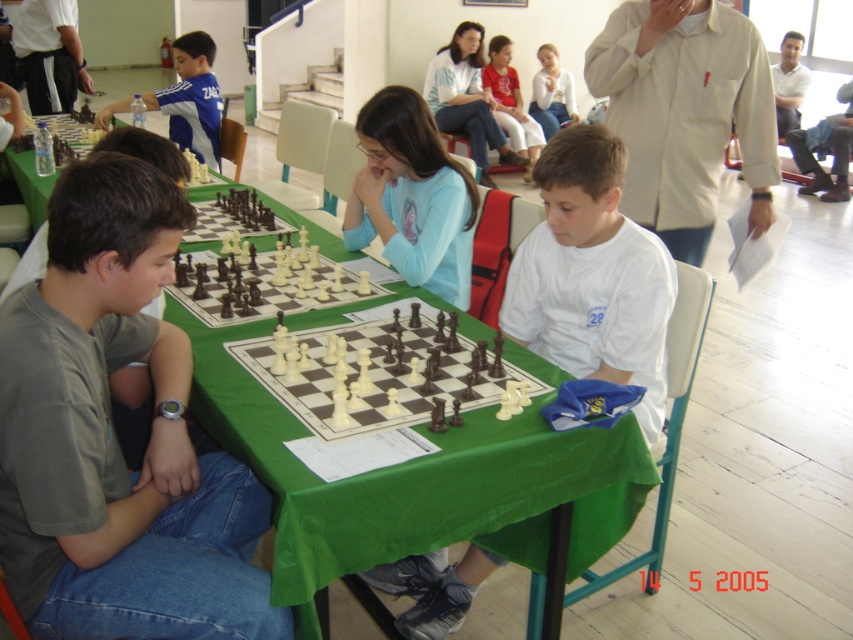
You are standing at the entrance of the chess tournament hall and want to quickly locate the green fabric table at center. Based on the coordinates provided, in which general direction should you look to find it?

The green fabric table at center is located at coordinates approximately 0.753 on the x axis and 0.489 on the y axis. Since the x coordinate is closer to 1, it is positioned more to the right side of the image. The y coordinate is near the middle, so it is centrally placed vertically. Therefore, you should look towards the right half of the image to find the green fabric table at center.

You are a chess player sitting at the table and need to place a new chess piece on the board. The board has two marked points, point 1 at coordinates point [195,240] and point 2 at coordinates point [786,38]. Which point is closer to you, the player?

Point [195,240] is in front of point [786,38], so the point closer to you is point [195,240].

You are a chess player sitting at the table with the matte pink shirt at center and the wooden chess set at center. You need to make a move but realize your hand is blocking the wooden chess set. Which object should you move first to access the chess pieces?

You should move the matte pink shirt at center first because the wooden chess set at center is behind it, so moving the shirt will allow you to access the chess pieces without obstruction.